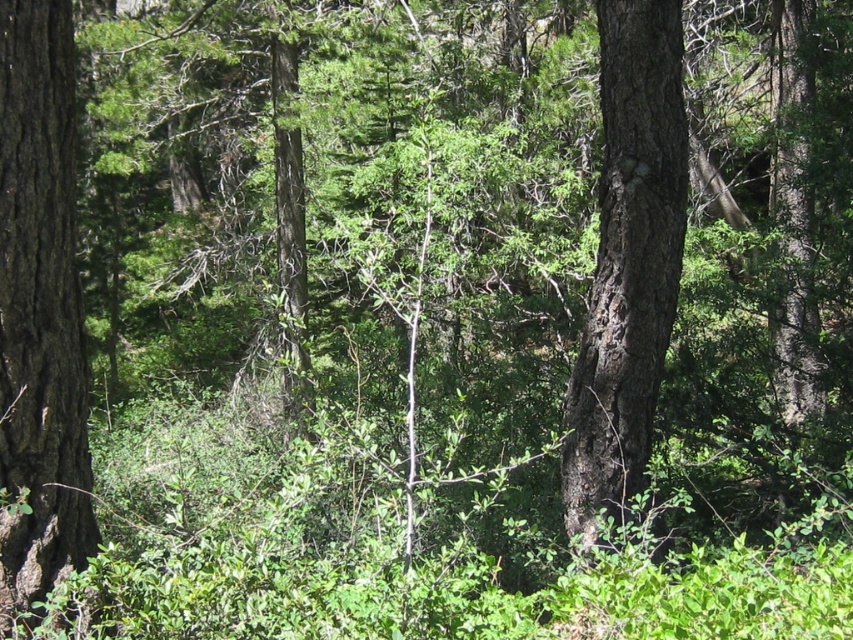
Who is more distant from viewer, (38, 301) or (660, 131)?

Point (660, 131)

Locate an element on the screen. The height and width of the screenshot is (640, 853). smooth brown bark at left is located at coordinates 39,310.

Which is behind, point (61, 170) or point (636, 211)?

Positioned behind is point (636, 211).

Where is `smooth brown bark at left`? This screenshot has width=853, height=640. smooth brown bark at left is located at coordinates (39, 310).